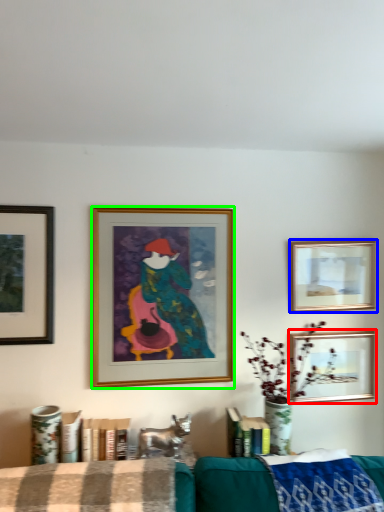
Question: Considering the real-world distances, which object is farthest from picture frame (highlighted by a red box)? picture frame (highlighted by a blue box) or picture frame (highlighted by a green box)?

Choices:
 (A) picture frame
 (B) picture frame

Answer: (B)